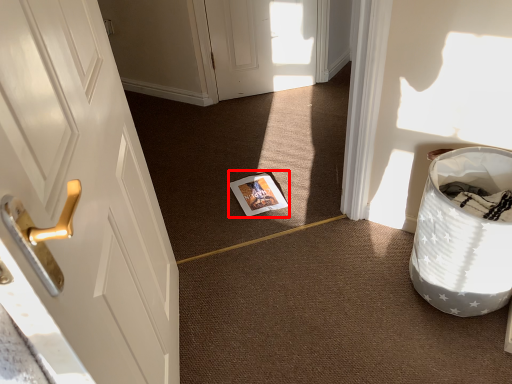
Question: From the image's perspective, what is the correct spatial relationship of magazine (annotated by the red box) in relation to laundry basket?

Choices:
 (A) below
 (B) above

Answer: (B)